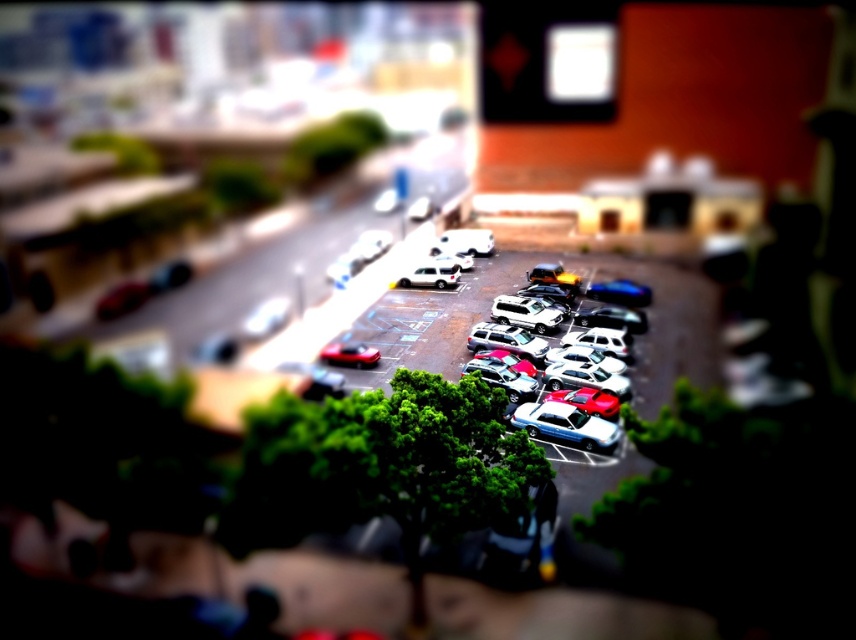
Is point (508, 412) closer to camera compared to point (346, 349)?

Yes, it is.

Does shiny silver sedan at center have a larger size compared to shiny red car at center?

Yes, shiny silver sedan at center is bigger than shiny red car at center.

Measure the distance between shiny silver sedan at center and camera.

They are 35.84 meters apart.

This screenshot has width=856, height=640. What are the coordinates of `shiny silver sedan at center` in the screenshot? It's located at (581, 396).

Describe the element at coordinates (425, 324) in the screenshot. I see `shiny metallic cars at center` at that location.

Is point (593, 461) closer to camera compared to point (614, 435)?

Yes, point (593, 461) is in front of point (614, 435).

Image resolution: width=856 pixels, height=640 pixels. What are the coordinates of `shiny metallic cars at center` in the screenshot? It's located at (425, 324).

Is shiny metallic cars at center smaller than shiny red car at center?

No.

Is shiny metallic cars at center positioned behind shiny red car at center?

No, shiny metallic cars at center is closer to the viewer.

What do you see at coordinates (425, 324) in the screenshot? The image size is (856, 640). I see `shiny metallic cars at center` at bounding box center [425, 324].

Where is `shiny metallic cars at center`? The width and height of the screenshot is (856, 640). shiny metallic cars at center is located at coordinates (425, 324).